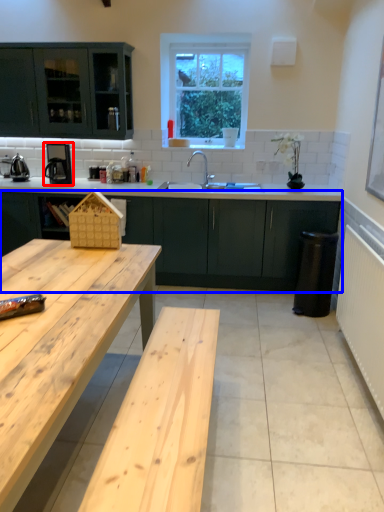
Question: Which point is closer to the camera, coffee machine (highlighted by a red box) or cabinetry (highlighted by a blue box)?

Choices:
 (A) coffee machine
 (B) cabinetry

Answer: (B)